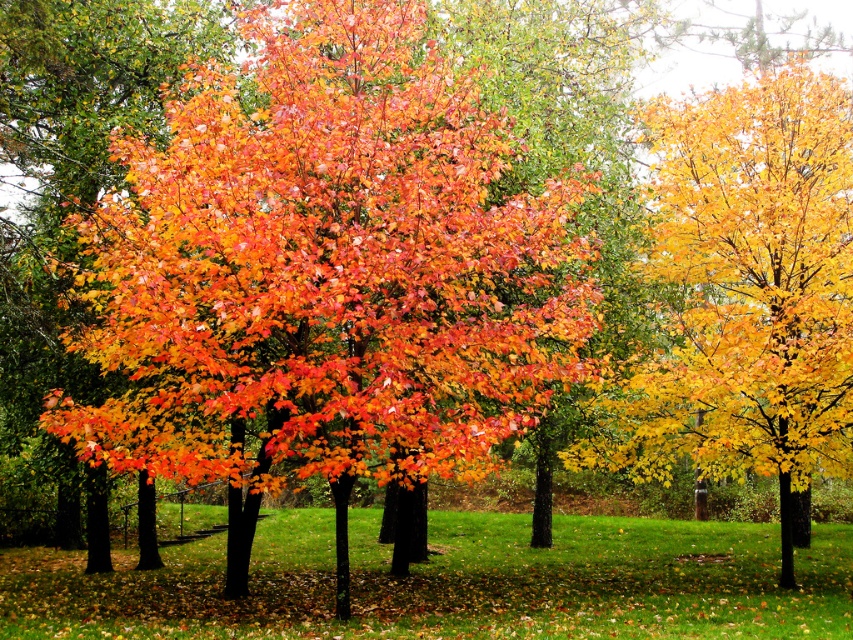
Question: Does shiny orange leaves at center appear over golden yellow leaves at right?

Choices:
 (A) no
 (B) yes

Answer: (B)

Question: Is shiny orange leaves at center to the right of golden yellow leaves at right from the viewer's perspective?

Choices:
 (A) yes
 (B) no

Answer: (B)

Question: Among these objects, which one is farthest from the camera?

Choices:
 (A) golden yellow leaves at right
 (B) shiny orange leaves at center

Answer: (B)

Question: In this image, where is shiny orange leaves at center located relative to golden yellow leaves at right?

Choices:
 (A) above
 (B) below

Answer: (A)